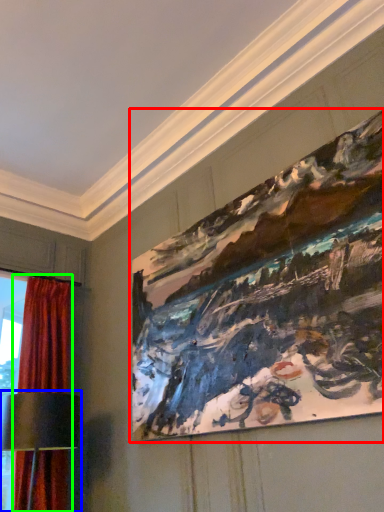
Question: Which object is positioned closest to picture frame (highlighted by a red box)? Select from table lamp (highlighted by a blue box) and curtain (highlighted by a green box).

Choices:
 (A) table lamp
 (B) curtain

Answer: (A)